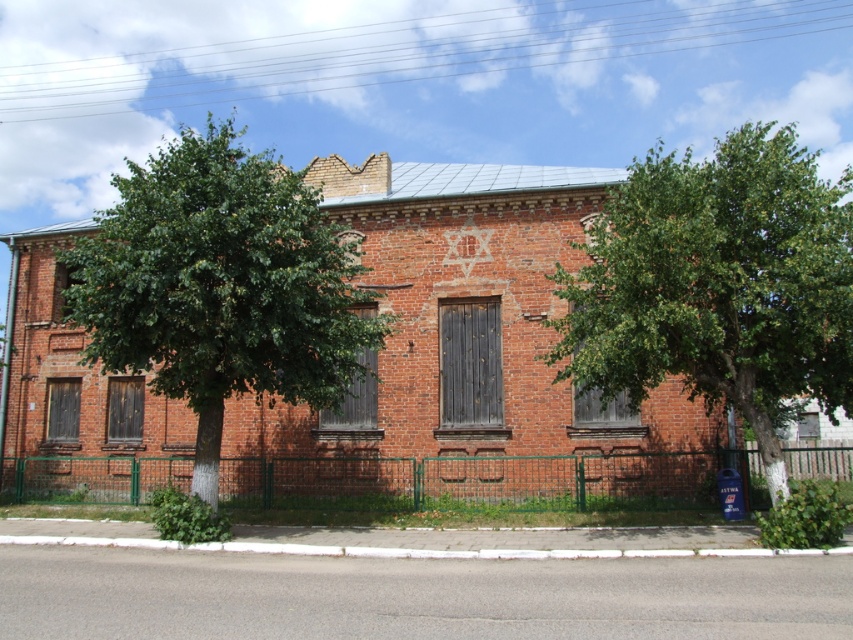
You are standing in front of the brick building and want to walk towards the green leafy tree at right and the green leafy tree at left. Which tree should you walk towards first to reach the closer one?

You should walk towards the green leafy tree at right first because it is closer to the viewer than the green leafy tree at left.